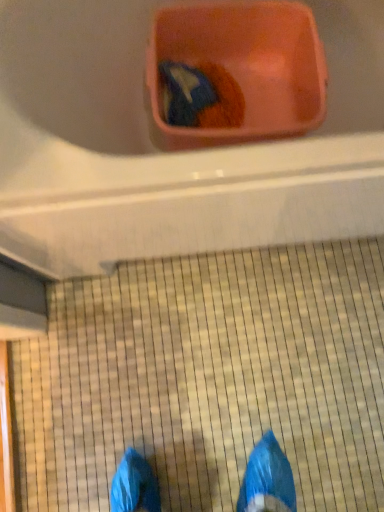
Measure the distance between orange plastic bin at upper center and camera.

60.65 centimeters.

What is the approximate width of orange plastic bin at upper center?

It is 28.29 inches.

What do you see at coordinates (173, 153) in the screenshot?
I see `orange plastic bin at upper center` at bounding box center [173, 153].

The image size is (384, 512). I want to click on orange plastic bin at upper center, so click(173, 153).

Locate an element on the screen. The width and height of the screenshot is (384, 512). orange plastic bin at upper center is located at coordinates (173, 153).